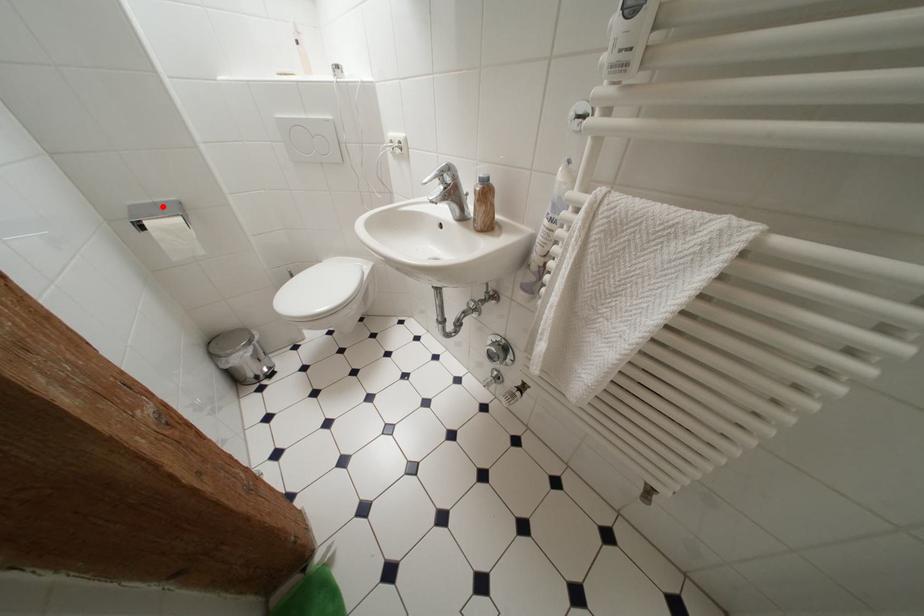
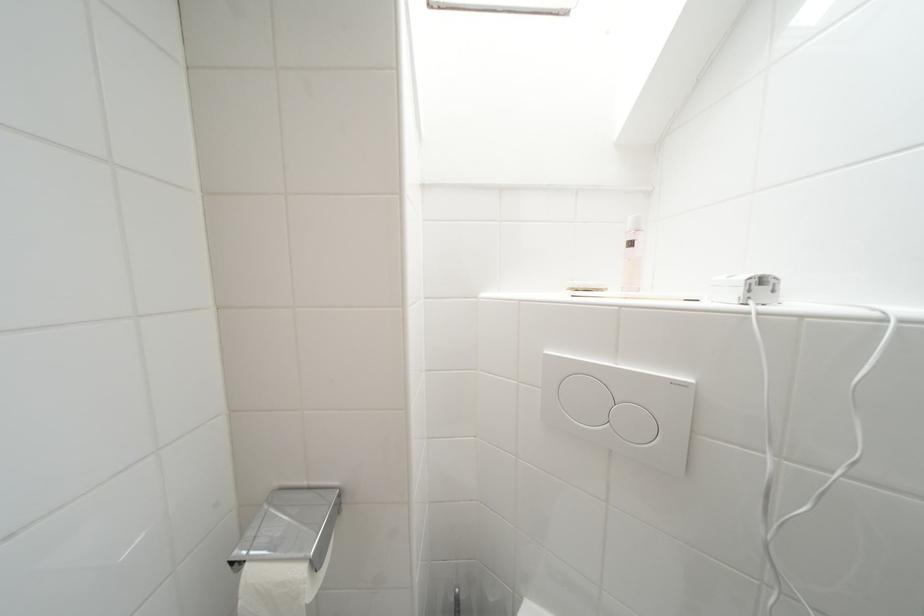
In the second image, find the point that corresponds to the highlighted location in the first image.

(315, 491)